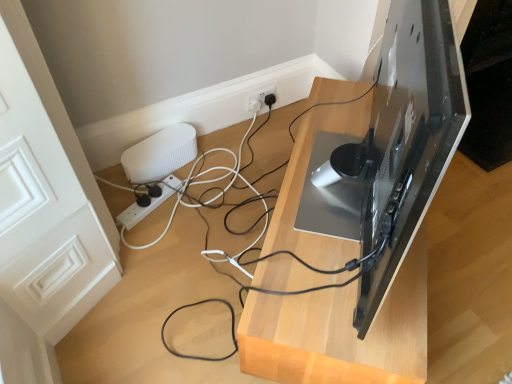
Locate an element on the screen. vacant space to the left of white plastic power strip at lower center is located at coordinates (121, 201).